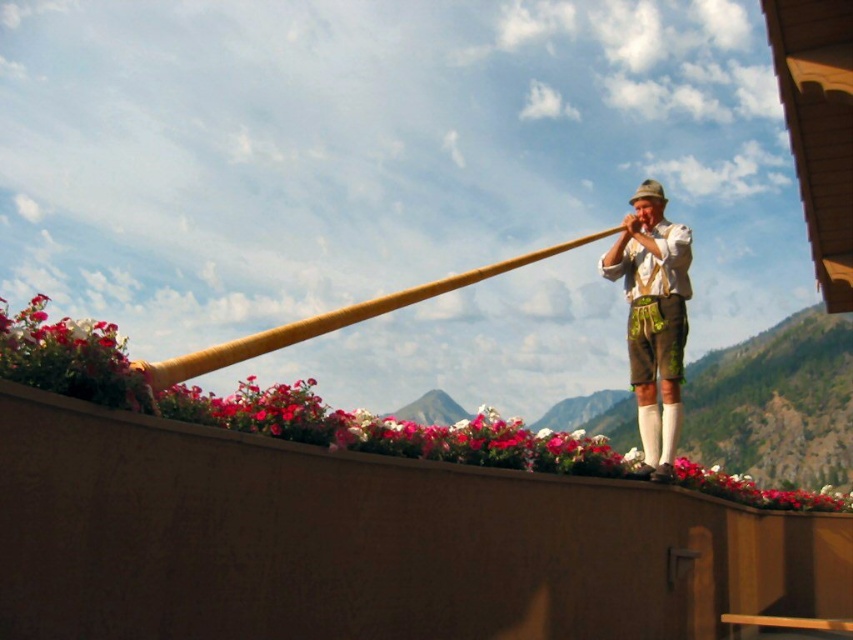
You are a photographer trying to capture the entire scene. You notice two points of interest marked as point (666, 387) and point (375, 301). Which point is closer to your camera lens?

Point (375, 301) is closer to the camera lens because it is less further than point (666, 387).